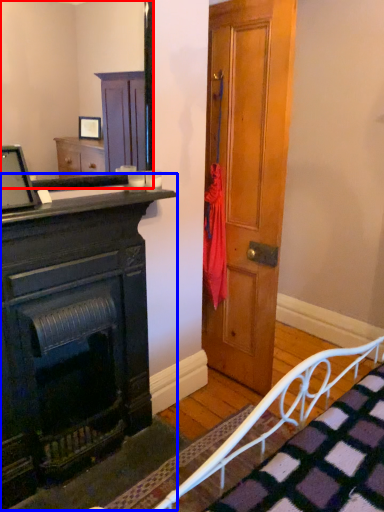
Question: Which object is further to the camera taking this photo, mirror (highlighted by a red box) or chest of drawers (highlighted by a blue box)?

Choices:
 (A) mirror
 (B) chest of drawers

Answer: (B)